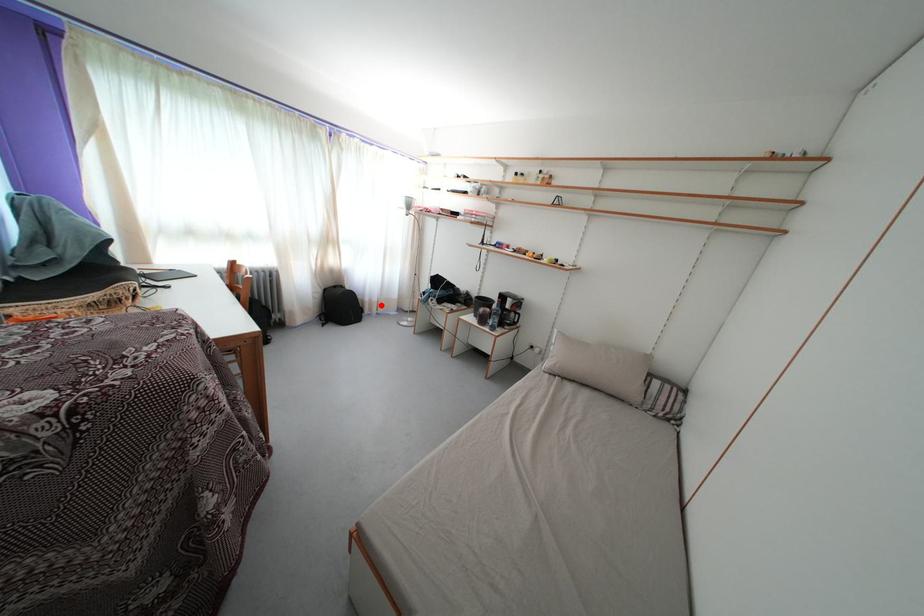
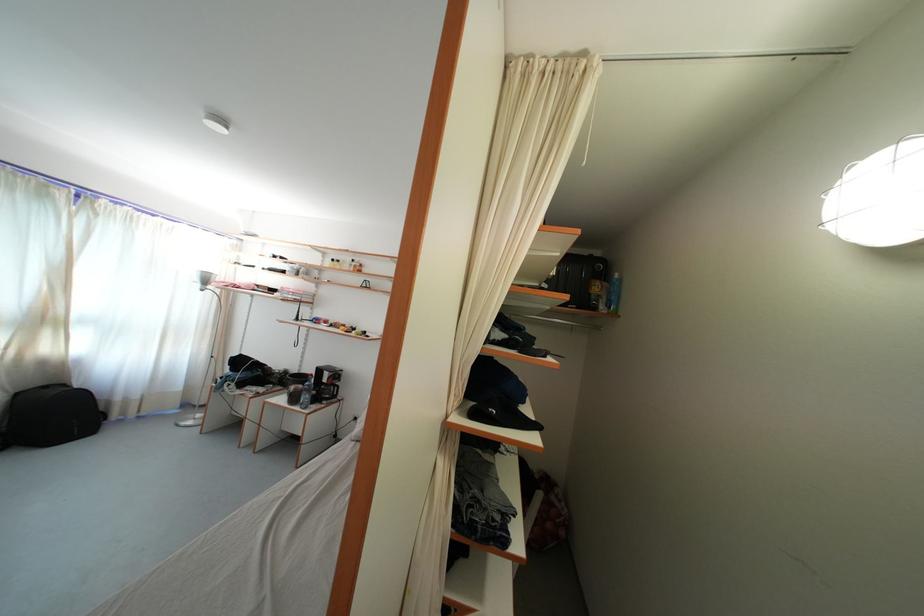
Where in the second image is the point corresponding to the highlighted location from the first image?

(141, 403)